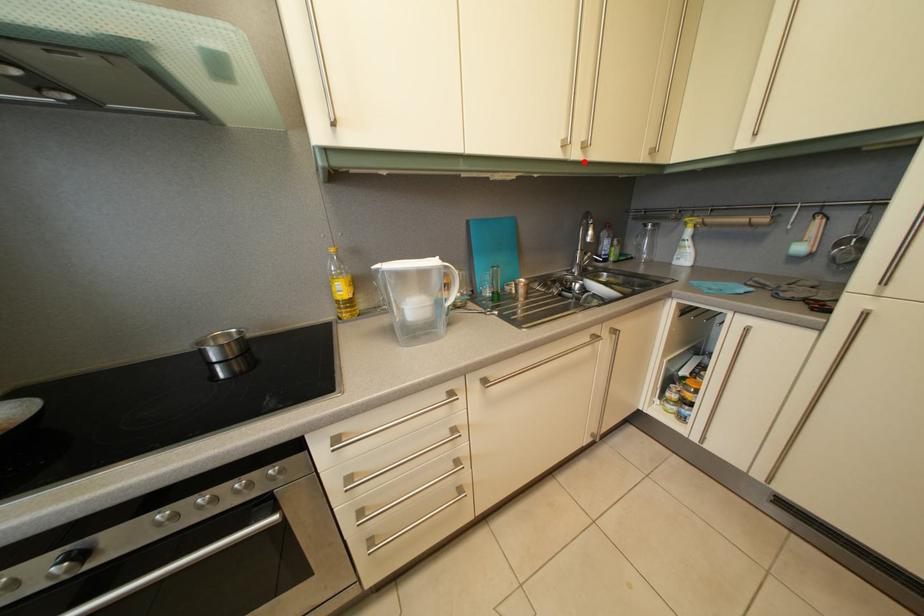
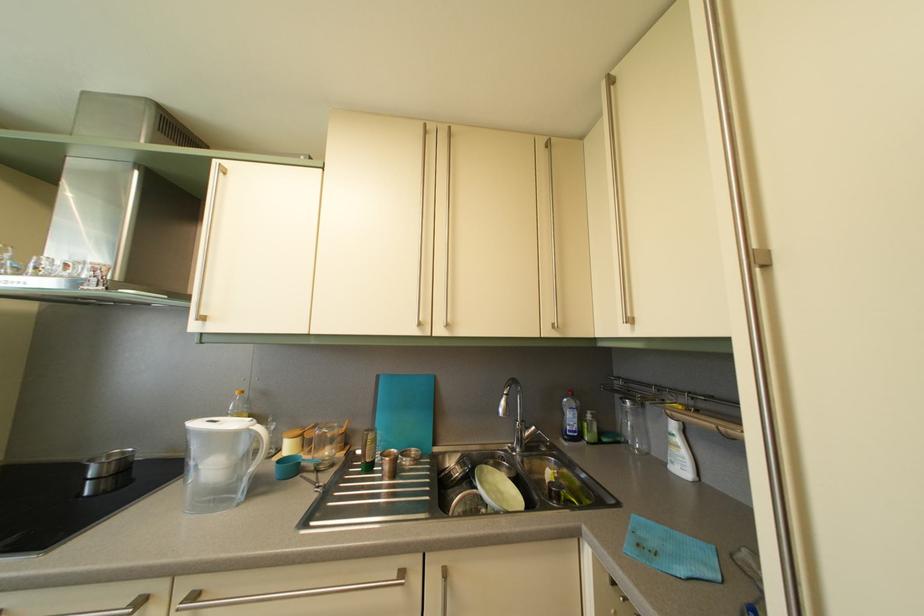
Locate, in the second image, the point that corresponds to the highlighted location in the first image.

(447, 339)